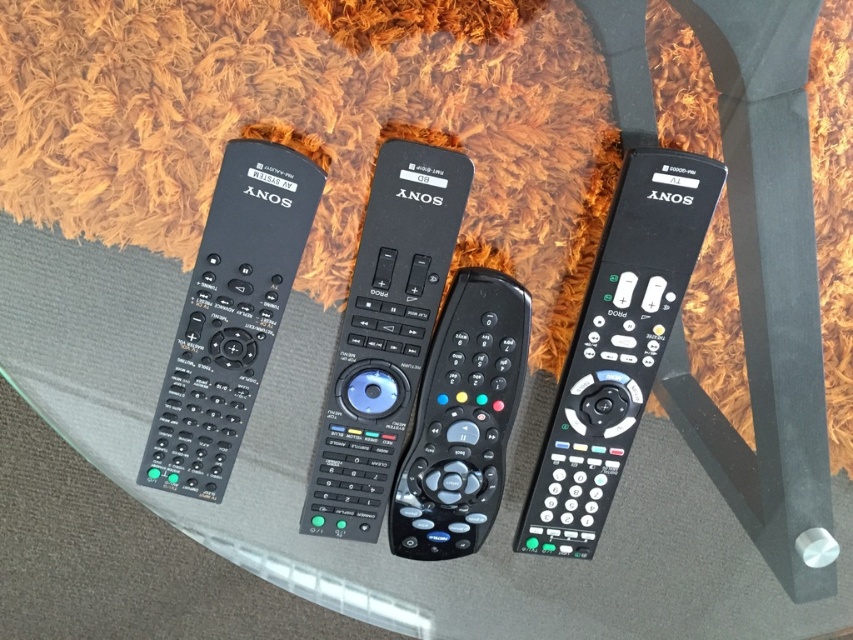
Question: Does black plastic remote at right come behind black plastic remote at center?

Choices:
 (A) yes
 (B) no

Answer: (B)

Question: Which object is positioned farthest from the black matte remote at left?

Choices:
 (A) black plastic remote at right
 (B) black matte remote at center

Answer: (A)

Question: Is black plastic remote at right positioned in front of black plastic remote at center?

Choices:
 (A) no
 (B) yes

Answer: (B)

Question: Which point is closer to the camera?

Choices:
 (A) (369, 342)
 (B) (517, 317)
 (C) (642, 400)
 (D) (247, 152)

Answer: (D)

Question: Is black matte remote at left bigger than black plastic remote at center?

Choices:
 (A) yes
 (B) no

Answer: (A)

Question: Estimate the real-world distances between objects in this image. Which object is farther from the black plastic remote at center?

Choices:
 (A) black matte remote at left
 (B) black matte remote at center
 (C) black plastic remote at right

Answer: (A)